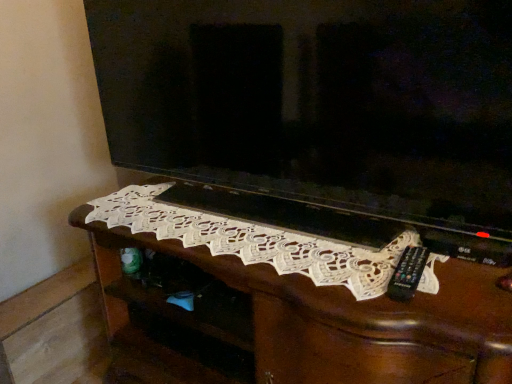
Where is `vacant space underneath matte black television at center (from a real-world perspective)`? vacant space underneath matte black television at center (from a real-world perspective) is located at coordinates (257, 208).